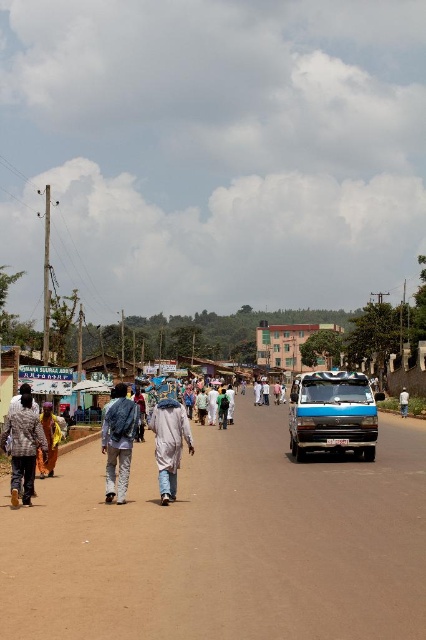
Who is more distant from viewer, (173,451) or (403,397)?

The point (403,397) is more distant.

Does point (175, 464) come closer to viewer compared to point (399, 403)?

Yes, point (175, 464) is closer to viewer.

Is point (161, 449) farther from camera compared to point (408, 394)?

No, (161, 449) is in front of (408, 394).

Find the location of a particular element. This screenshot has width=426, height=640. light gray fabric coat at center is located at coordinates (169, 442).

Does yellow fabric bag at lower left have a larger size compared to white cotton shirt at center?

No, yellow fabric bag at lower left is not bigger than white cotton shirt at center.

Between yellow fabric bag at lower left and white cotton shirt at center, which one is positioned lower?

white cotton shirt at center

Who is more distant from viewer, (52, 461) or (405, 397)?

Positioned behind is point (405, 397).

The height and width of the screenshot is (640, 426). Find the location of `yellow fabric bag at lower left`. yellow fabric bag at lower left is located at coordinates (48, 442).

Is point (11, 496) more distant than point (40, 460)?

No.

Is point (45, 440) closer to camera compared to point (45, 460)?

Yes, it is in front of point (45, 460).

Image resolution: width=426 pixels, height=640 pixels. I want to click on plaid fabric shirt at lower left, so click(23, 449).